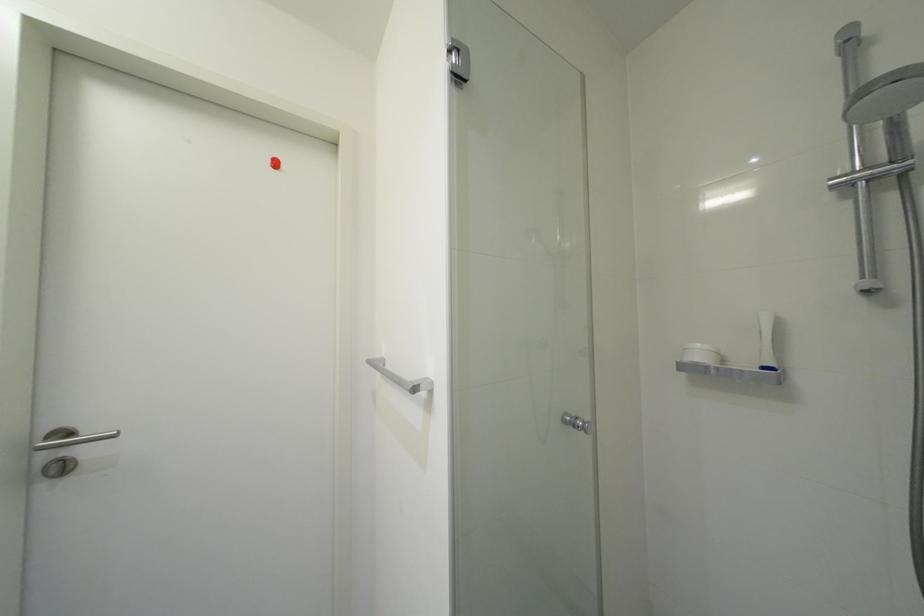
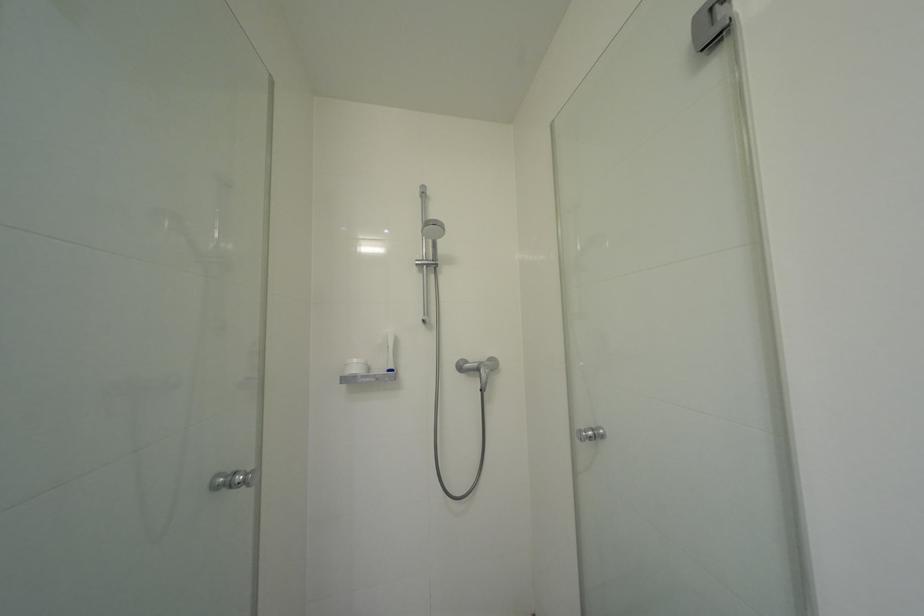
Question: The camera is either moving clockwise (left) or counter-clockwise (right) around the object. The first image is from the beginning of the video and the second image is from the end. Is the camera moving left or right when shooting the video?

Choices:
 (A) Left
 (B) Right

Answer: (A)